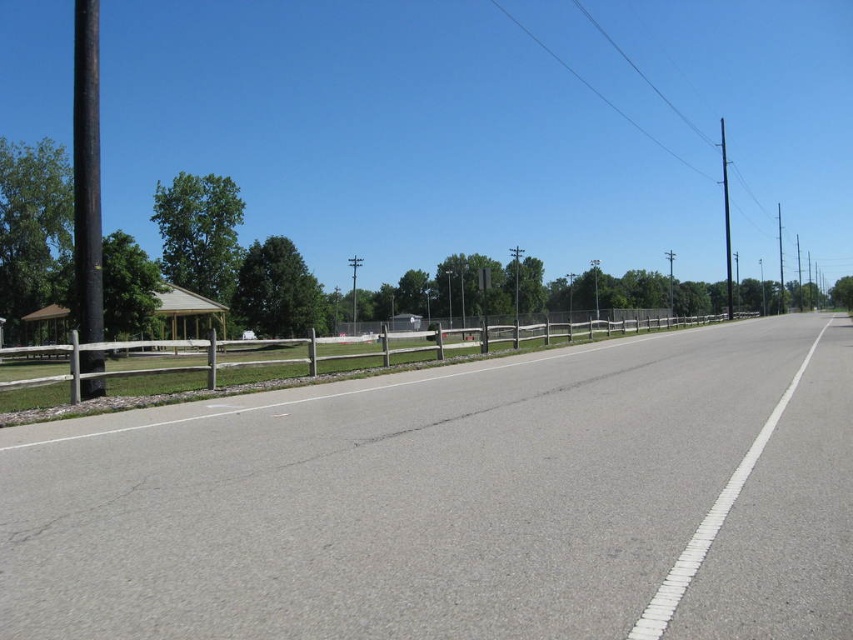
Question: Based on their relative distances, which object is farther from the black matte pole at left?

Choices:
 (A) metallic pole at right
 (B) gray asphalt highway at center

Answer: (A)

Question: Does brown wooden fence at left appear on the right side of black matte pole at left?

Choices:
 (A) yes
 (B) no

Answer: (A)

Question: Can you confirm if gray asphalt highway at center is bigger than metallic pole at right?

Choices:
 (A) no
 (B) yes

Answer: (A)

Question: Which point is farther from the camera taking this photo?

Choices:
 (A) (727, 198)
 (B) (782, 308)
 (C) (460, 352)

Answer: (A)

Question: Is black matte pole at left bigger than metallic pole at right?

Choices:
 (A) yes
 (B) no

Answer: (B)

Question: Which object appears closest to the camera in this image?

Choices:
 (A) brown wooden fence at left
 (B) black metallic pole at right
 (C) black matte pole at left

Answer: (A)